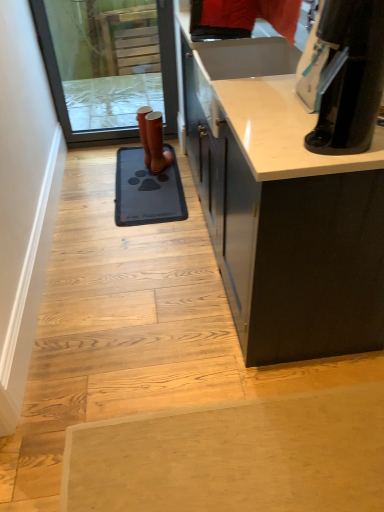
Where is `free space on the front side of blue rubber doormat at center`? free space on the front side of blue rubber doormat at center is located at coordinates (145, 253).